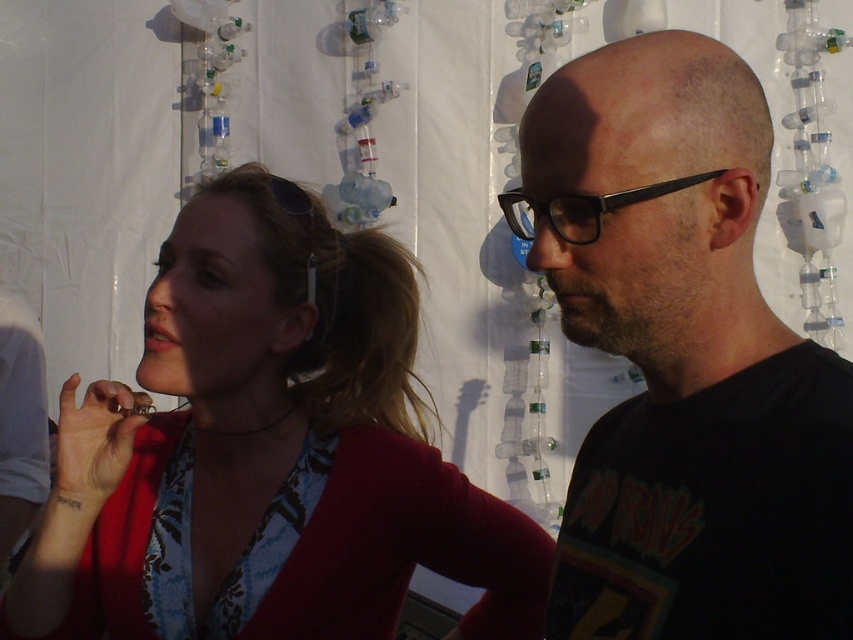
You are a photographer trying to capture a closeup shot of both the black matte shirt at center and the black plastic glasses at center. Given that your camera can only focus on objects within a 5 inch range, will you be able to capture both items in focus?

The black matte shirt at center and black plastic glasses at center are 6.27 inches apart, which exceeds the 5 inch focus range of the camera. Therefore, you cannot capture both items in focus simultaneously.

You are a fashion designer who wants to place a new accessory between the matte red sweater at center and the black plastic glasses at center. Given the space between them is 18.83 inches, can you fit a 12 inch long accessory between them?

The distance between the matte red sweater at center and the black plastic glasses at center is 18.83 inches, so a 12 inch long accessory can fit between them since it is shorter than the available space.